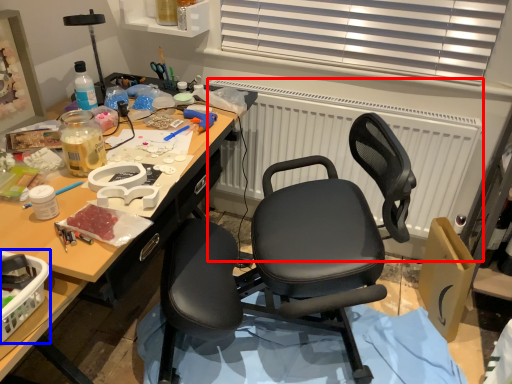
Question: Which point is further to the camera, radiator (highlighted by a red box) or box (highlighted by a blue box)?

Choices:
 (A) radiator
 (B) box

Answer: (A)